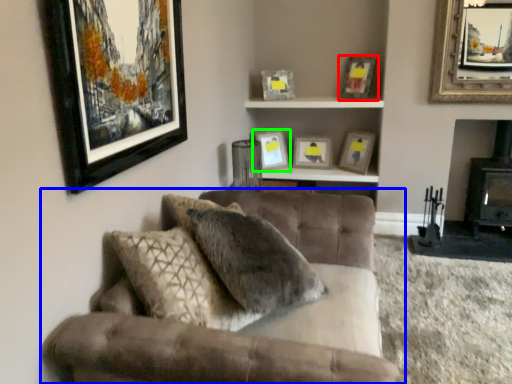
Question: Based on their relative distances, which object is nearer to picture frame (highlighted by a red box)? Choose from studio couch (highlighted by a blue box) and picture frame (highlighted by a green box).

Choices:
 (A) studio couch
 (B) picture frame

Answer: (B)